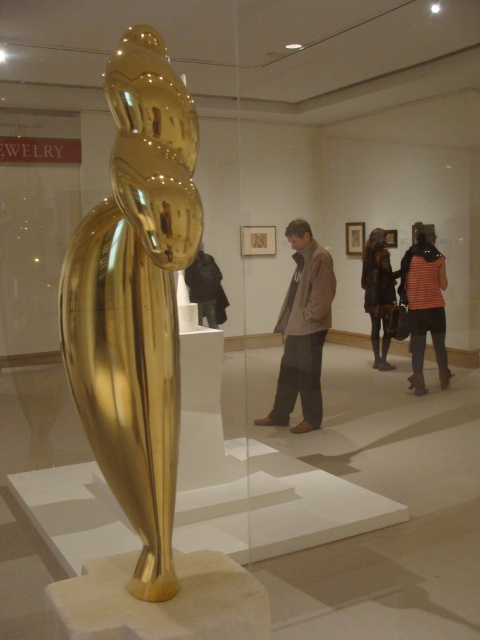
Based on the photo, who is higher up, gold polished sculpture at center or striped fabric at right?

striped fabric at right

Can you confirm if gold polished sculpture at center is positioned below striped fabric at right?

Indeed, gold polished sculpture at center is positioned under striped fabric at right.

Does point (156, 72) lie in front of point (434, 257)?

Yes.

You are a GUI agent. You are given a task and a screenshot of the screen. Output one action in this format:
    pyautogui.click(x=<x>, y=<y>)
    Task: Click on the gold polished sculpture at center
    
    Given the screenshot: What is the action you would take?
    pyautogui.click(x=135, y=298)

Between point (300, 368) and point (367, 268), which one is positioned behind?

The point (367, 268) is behind.

Which is below, brown leather jacket at center or dark brown leather jacket at center?

Positioned lower is brown leather jacket at center.

Is point (326, 296) more distant than point (374, 304)?

No, (326, 296) is closer to viewer.

The image size is (480, 640). I want to click on brown leather jacket at center, so click(x=302, y=330).

Which is behind, point (374, 256) or point (216, 324)?

The point (216, 324) is more distant.

Can you confirm if dark brown leather jacket at center is taller than black fabric jacket at center?

Indeed, dark brown leather jacket at center has a greater height compared to black fabric jacket at center.

Which is behind, point (383, 340) or point (184, 273)?

Point (383, 340)

Where is `dark brown leather jacket at center`? The image size is (480, 640). dark brown leather jacket at center is located at coordinates (377, 292).